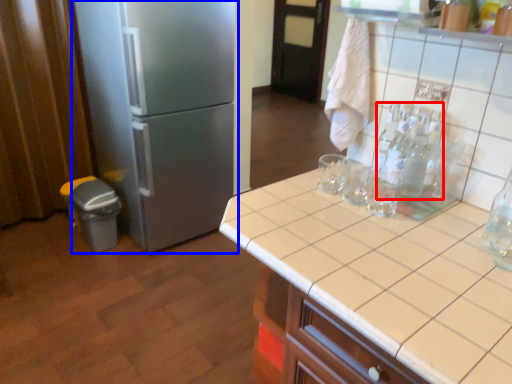
Question: Which object is closer to the camera taking this photo, bottle (highlighted by a red box) or refrigerator (highlighted by a blue box)?

Choices:
 (A) bottle
 (B) refrigerator

Answer: (A)